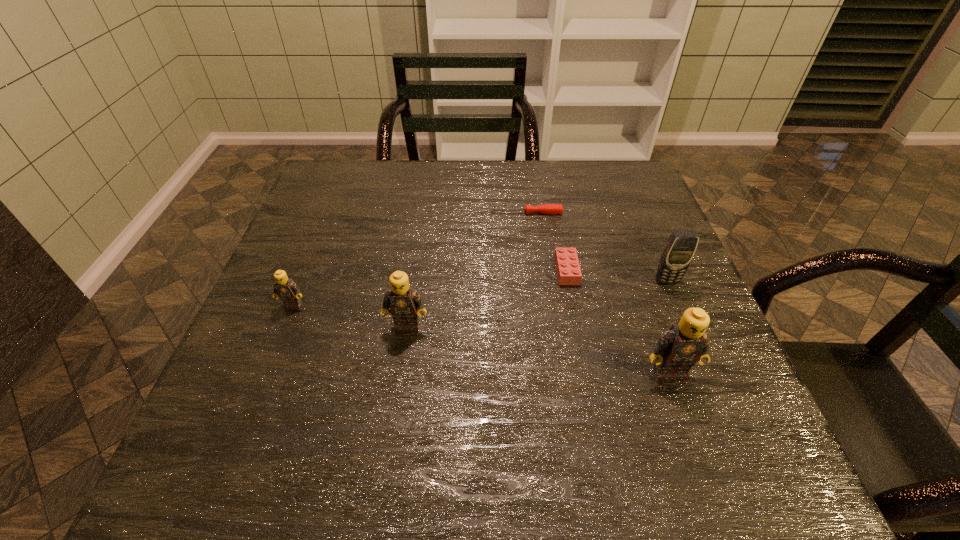
This screenshot has height=540, width=960. Find the location of `the farthest Lego`. the farthest Lego is located at coordinates (568, 269).

This screenshot has width=960, height=540. I want to click on free space located in front of the second shortest Lego, so click(254, 402).

Where is `vacant position located in front of the second tallest Lego`? The image size is (960, 540). vacant position located in front of the second tallest Lego is located at coordinates (394, 414).

Identify the location of vacant point located 0.060m in front of the nearest Lego. (682, 412).

Where is `vacant area situated at the tip of the farthest object`? Image resolution: width=960 pixels, height=540 pixels. vacant area situated at the tip of the farthest object is located at coordinates (413, 213).

Where is `vacant space located at the tip of the farthest object`? Image resolution: width=960 pixels, height=540 pixels. vacant space located at the tip of the farthest object is located at coordinates (449, 213).

Locate an element on the screen. Image resolution: width=960 pixels, height=540 pixels. vacant space located at the tip of the farthest object is located at coordinates (372, 213).

Locate an element on the screen. This screenshot has width=960, height=540. vacant area situated 0.160m on the front face of the cellular telephone is located at coordinates (693, 343).

Where is `free region located on the left of the shortest Lego`? The image size is (960, 540). free region located on the left of the shortest Lego is located at coordinates (454, 271).

Identify the location of object located in the near edge section of the desktop. The image size is (960, 540). (678, 349).